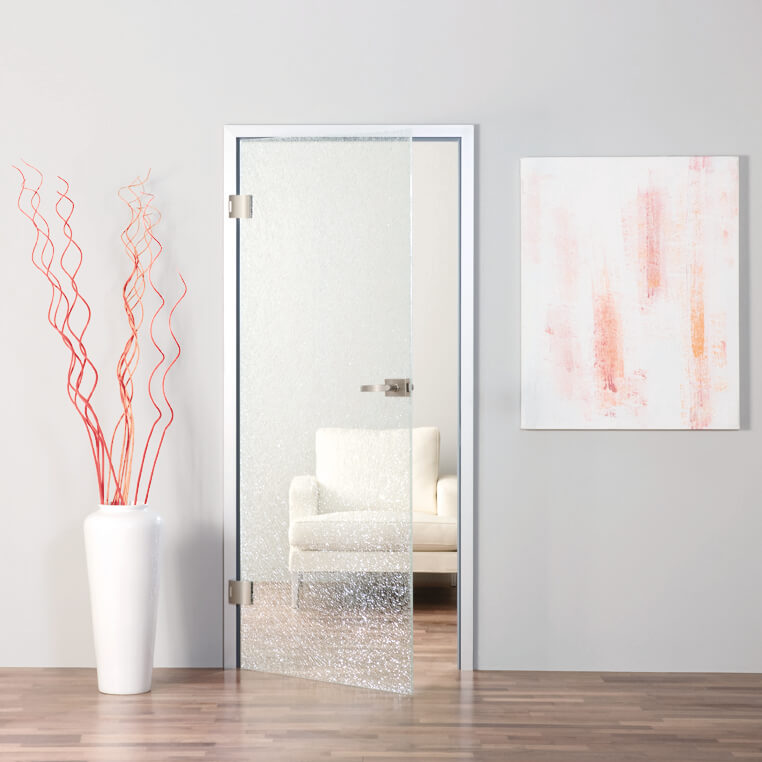
This screenshot has height=762, width=762. I want to click on door, so click(x=373, y=520).